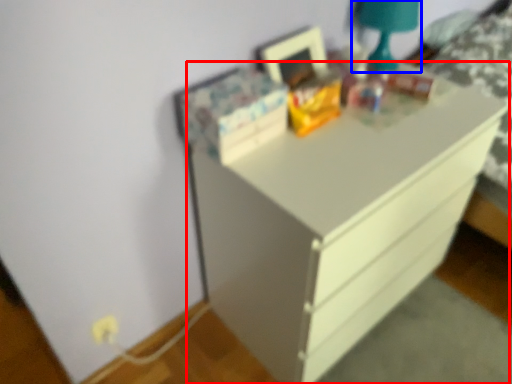
Question: Which object appears farthest to the camera in this image, chest of drawers (highlighted by a red box) or bedside lamp (highlighted by a blue box)?

Choices:
 (A) chest of drawers
 (B) bedside lamp

Answer: (B)